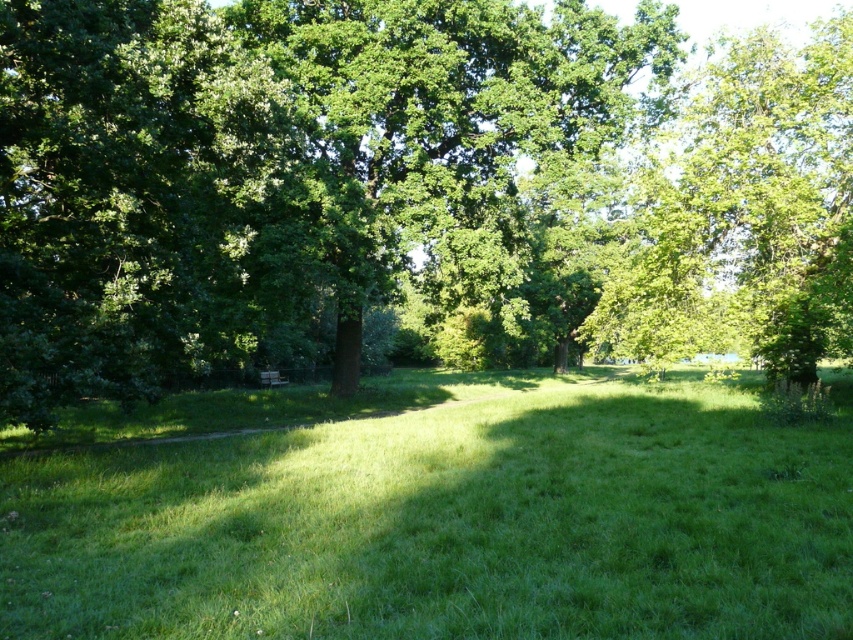
Looking at this image, who is more forward, (764, 269) or (846, 544)?

Point (846, 544) is more forward.

Is the position of green leafy tree at center less distant than that of green grassy field at center?

That is False.

I want to click on green leafy tree at center, so click(x=407, y=189).